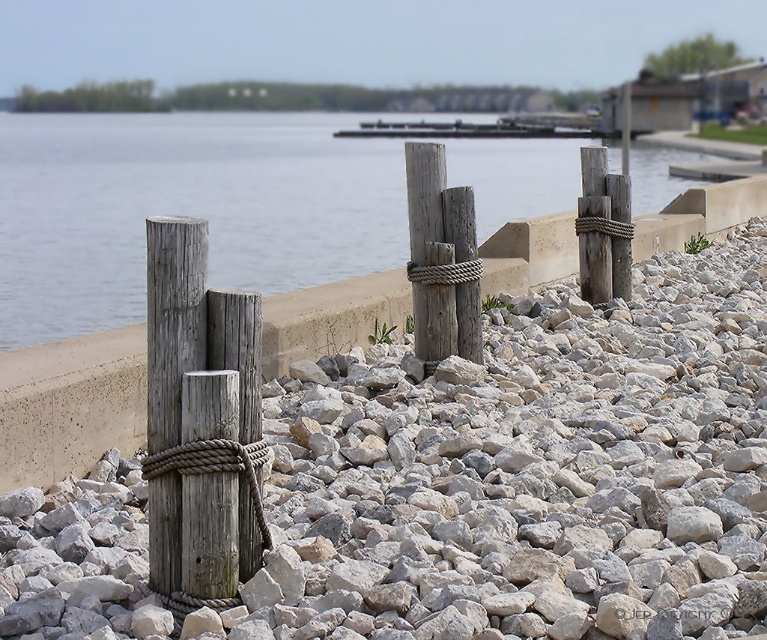
Is weathered wood post at center-left bigger than wooden dock at center?

Incorrect, weathered wood post at center-left is not larger than wooden dock at center.

Which is more to the left, weathered wood post at center-left or wooden dock at center?

weathered wood post at center-left is more to the left.

Does point (160, 429) come behind point (568, 136)?

No.

Image resolution: width=767 pixels, height=640 pixels. I want to click on weathered wood post at center-left, so click(173, 320).

Can you confirm if gray gravel at center is bigger than weathered wood post at center-left?

No.

Between gray gravel at center and weathered wood post at center-left, which one is positioned higher?

weathered wood post at center-left is above.

Identify the location of gray gravel at center. This screenshot has width=767, height=640. (528, 474).

How much distance is there between weathered wood post at center and wooden dock at center?

They are 26.51 meters apart.

Is point (435, 211) farther from camera compared to point (509, 136)?

No, it is not.

Which is behind, point (420, 330) or point (542, 131)?

The point (542, 131) is more distant.

The height and width of the screenshot is (640, 767). I want to click on weathered wood post at center, so click(x=423, y=195).